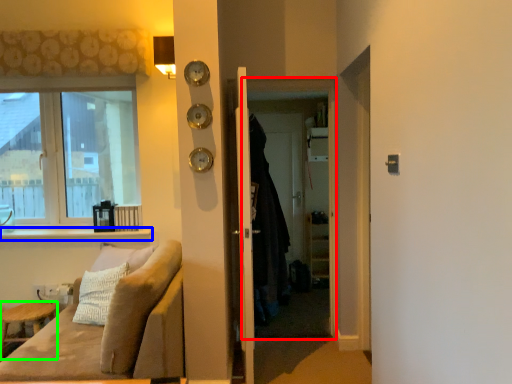
Question: Which object is the farthest from screen door (highlighted by a red box)? Choose among these: window sill (highlighted by a blue box) or furniture (highlighted by a green box).

Choices:
 (A) window sill
 (B) furniture

Answer: (B)